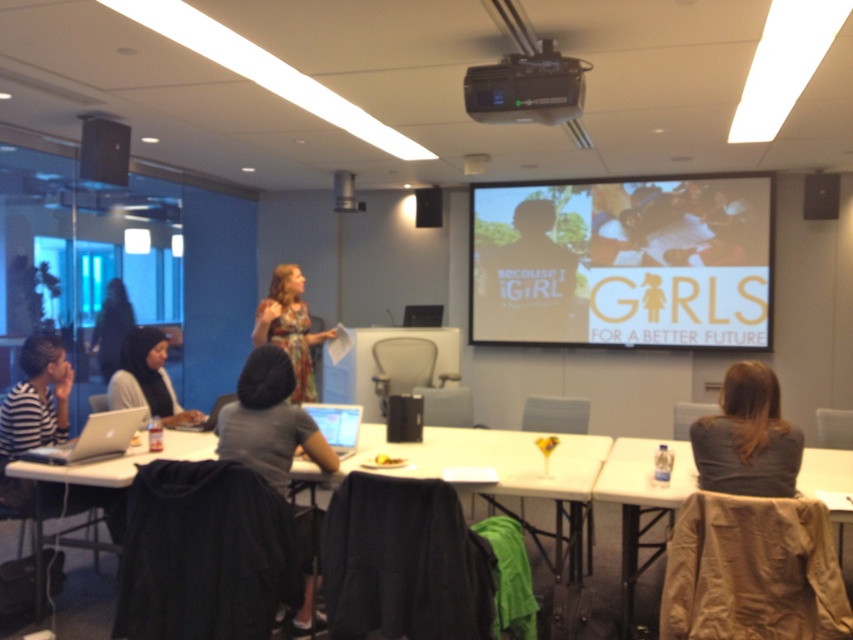
In the scene shown: You are an attendee in the conference room and you need to place your gray fabric jacket at lower right on the white plastic table at lower right. Can you do that?

The gray fabric jacket at lower right is to the right of white plastic table at lower right, so you can place it there.

You are organizing a workshop for 20 participants and need to place a laptop on the white plastic table at lower right and the black plastic projector at upper center. Considering their sizes, which object can accommodate more laptops?

The white plastic table at lower right can accommodate more laptops because its width is larger than the black plastic projector at upper center.

You are an attendee in the conference room and need to locate both the gray fabric jacket at lower right and the black plastic projector at upper center. Based on their positions, which object is closer to the right side of the room?

→ The gray fabric jacket at lower right is closer to the right side of the room because it is positioned to the right of the black plastic projector at upper center.